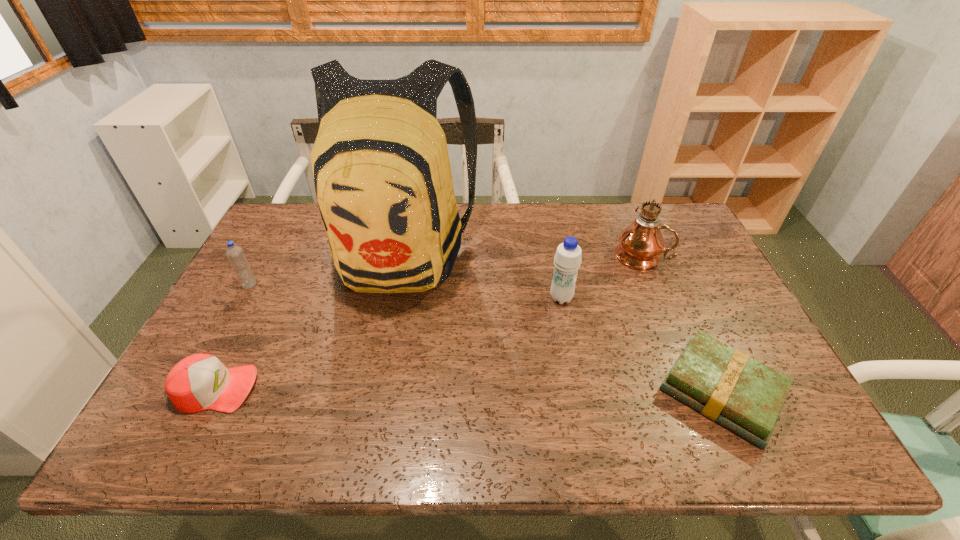
Find the location of a particular element. This screenshot has height=540, width=960. vacant region located 0.150m on the front of the oil lamp is located at coordinates (661, 306).

Find the location of `vacant space situated on the back of the taller water bottle`. vacant space situated on the back of the taller water bottle is located at coordinates (557, 273).

At what (x,y) coordinates should I click in order to perform the action: click on vacant space located 0.270m on the back of the shorter water bottle. Please return your answer as a coordinate pair (x, y). The height and width of the screenshot is (540, 960). Looking at the image, I should click on (281, 227).

This screenshot has width=960, height=540. I want to click on vacant area located 0.100m on the front-facing side of the fifth tallest object, so click(x=297, y=388).

Locate an element on the screen. The width and height of the screenshot is (960, 540). vacant space located on the left of the shortest object is located at coordinates (605, 392).

In order to click on backpack positioned at the far edge in this screenshot , I will do click(382, 175).

Identify the location of oil lamp that is at the far edge. This screenshot has height=540, width=960. (640, 244).

Locate an element on the screen. Image resolution: width=960 pixels, height=540 pixels. object situated at the near edge is located at coordinates coord(725,385).

Locate an element on the screen. water bottle that is at the left edge is located at coordinates (235, 254).

Find the location of `baseball cap positioned at the left edge`. baseball cap positioned at the left edge is located at coordinates (198, 382).